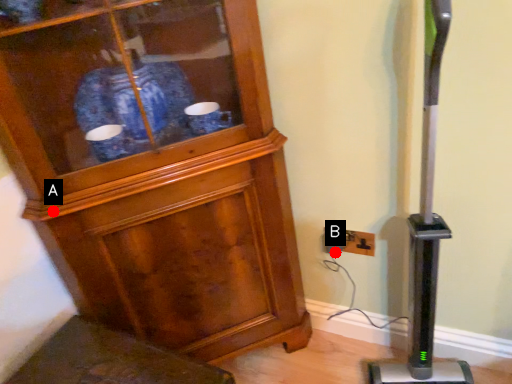
Question: Two points are circled on the image, labeled by A and B beside each circle. Which of the following is the farthest from the observer?

Choices:
 (A) A is further
 (B) B is further

Answer: (B)